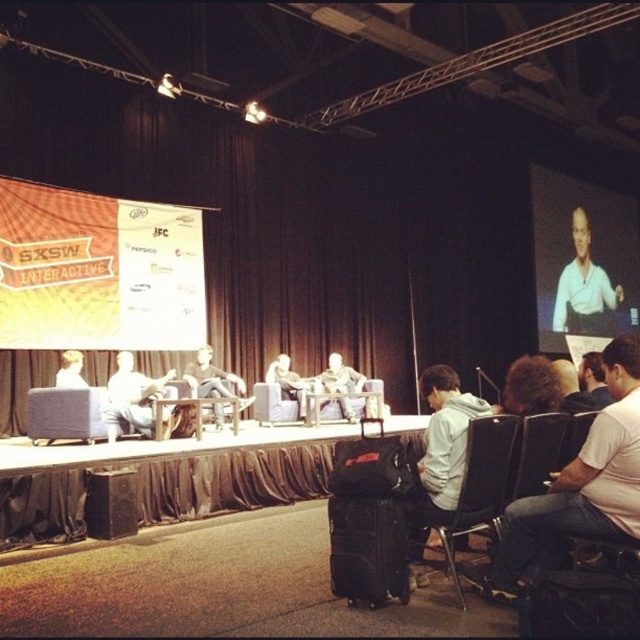
You are an attendee at the SXSW Interactive event and want to take a photo of the stage. You notice two points on the stage that are important for your shot. The first point is at coordinates point (592, 276), and the second is at point (266, 406). Which of these points will appear closer to the camera in your photo?

Point (266, 406) will appear closer to the camera because it is in front of point (592, 276) according to their spatial relationship.

You are an attendee at the SXSW Interactive event and you want to take a photo of the stage. The white cotton shirt at lower right and the black fabric speaker at lower left are both in your camera frame. Which object should you focus on first if you want to capture both clearly in the same shot?

The white cotton shirt at lower right is bigger than the black fabric speaker at lower left, so you should focus on the white cotton shirt at lower right first to ensure both are in focus.